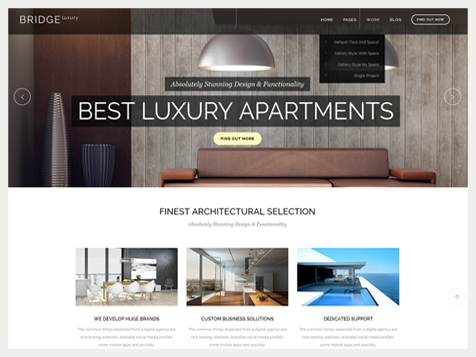
Locate an element on the screen. wall in background image is located at coordinates (153, 143).